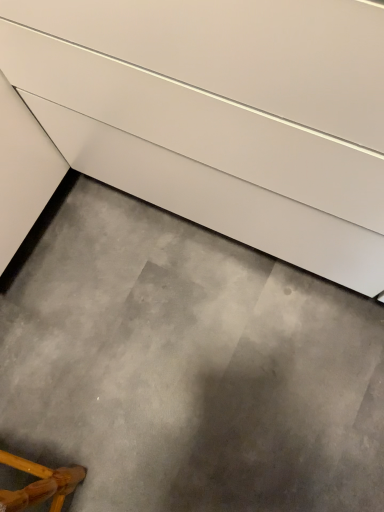
Question: Is wooden chair at lower left shorter than white glossy drawer at upper center?

Choices:
 (A) yes
 (B) no

Answer: (A)

Question: Considering the relative sizes of wooden chair at lower left and white glossy drawer at upper center in the image provided, is wooden chair at lower left wider than white glossy drawer at upper center?

Choices:
 (A) no
 (B) yes

Answer: (A)

Question: Is wooden chair at lower left to the right of white glossy drawer at upper center from the viewer's perspective?

Choices:
 (A) yes
 (B) no

Answer: (B)

Question: Is wooden chair at lower left smaller than white glossy drawer at upper center?

Choices:
 (A) yes
 (B) no

Answer: (A)

Question: From the image's perspective, is wooden chair at lower left beneath white glossy drawer at upper center?

Choices:
 (A) no
 (B) yes

Answer: (B)

Question: Does point (89, 44) appear closer or farther from the camera than point (62, 484)?

Choices:
 (A) farther
 (B) closer

Answer: (B)

Question: From the image's perspective, is white glossy drawer at upper center above or below wooden chair at lower left?

Choices:
 (A) above
 (B) below

Answer: (A)

Question: Considering the positions of white glossy drawer at upper center and wooden chair at lower left in the image, is white glossy drawer at upper center bigger or smaller than wooden chair at lower left?

Choices:
 (A) small
 (B) big

Answer: (B)

Question: Considering the positions of white glossy drawer at upper center and wooden chair at lower left in the image, is white glossy drawer at upper center taller or shorter than wooden chair at lower left?

Choices:
 (A) tall
 (B) short

Answer: (A)

Question: Considering the relative positions of wooden chair at lower left and gray concrete at lower center in the image provided, is wooden chair at lower left to the left or to the right of gray concrete at lower center?

Choices:
 (A) right
 (B) left

Answer: (B)

Question: Considering the positions of wooden chair at lower left and gray concrete at lower center in the image, is wooden chair at lower left taller or shorter than gray concrete at lower center?

Choices:
 (A) short
 (B) tall

Answer: (B)

Question: Considering the positions of wooden chair at lower left and gray concrete at lower center in the image, is wooden chair at lower left wider or thinner than gray concrete at lower center?

Choices:
 (A) wide
 (B) thin

Answer: (B)

Question: From the image's perspective, is wooden chair at lower left located above or below gray concrete at lower center?

Choices:
 (A) above
 (B) below

Answer: (B)

Question: Looking at their shapes, would you say gray concrete at lower center is wider or thinner than wooden chair at lower left?

Choices:
 (A) wide
 (B) thin

Answer: (A)

Question: From the image's perspective, is gray concrete at lower center above or below wooden chair at lower left?

Choices:
 (A) above
 (B) below

Answer: (A)